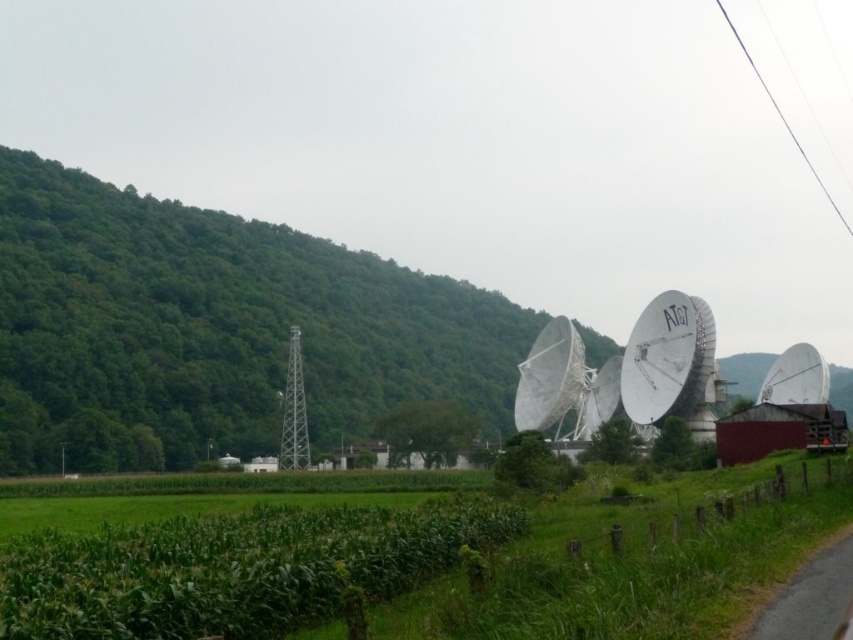
Describe the element at coordinates (422, 564) in the screenshot. The height and width of the screenshot is (640, 853). I see `green grassy corn field at center` at that location.

What are the coordinates of `green grassy corn field at center` in the screenshot? It's located at (422, 564).

Where is `green grassy corn field at center`? The height and width of the screenshot is (640, 853). green grassy corn field at center is located at coordinates (422, 564).

Who is positioned more to the right, green grassy corn field at center or white metallic satellite at center?

From the viewer's perspective, white metallic satellite at center appears more on the right side.

Describe the element at coordinates (422, 564) in the screenshot. The height and width of the screenshot is (640, 853). I see `green grassy corn field at center` at that location.

The image size is (853, 640). Find the location of `green grassy corn field at center`. green grassy corn field at center is located at coordinates (422, 564).

Does green leafy corn at lower left have a lesser height compared to white metallic satellite at center?

Yes.

Does point (393, 593) lie in front of point (560, 332)?

Yes, it is in front of point (560, 332).

The width and height of the screenshot is (853, 640). Find the location of `green leafy corn at lower left`. green leafy corn at lower left is located at coordinates (231, 570).

This screenshot has height=640, width=853. I want to click on green leafy corn at lower left, so click(231, 570).